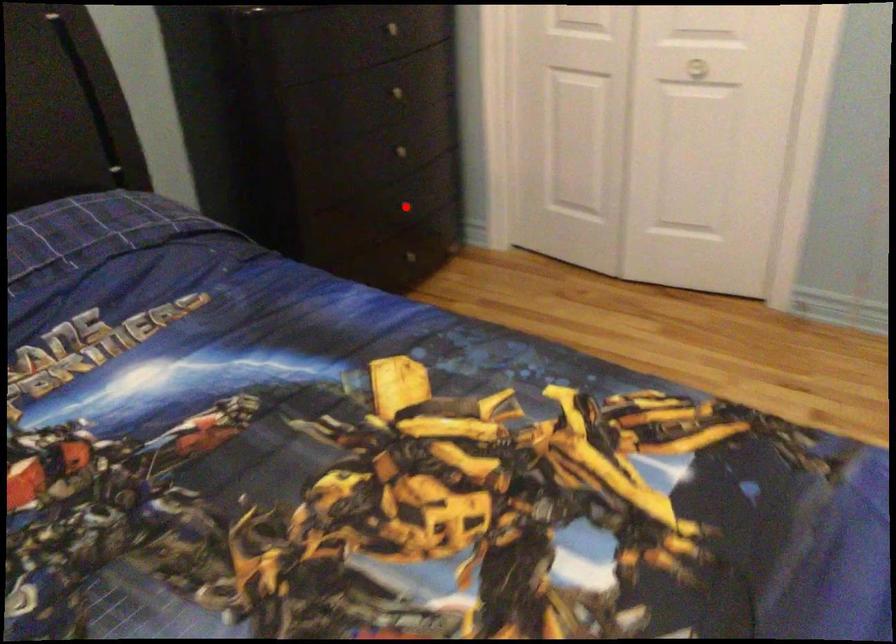
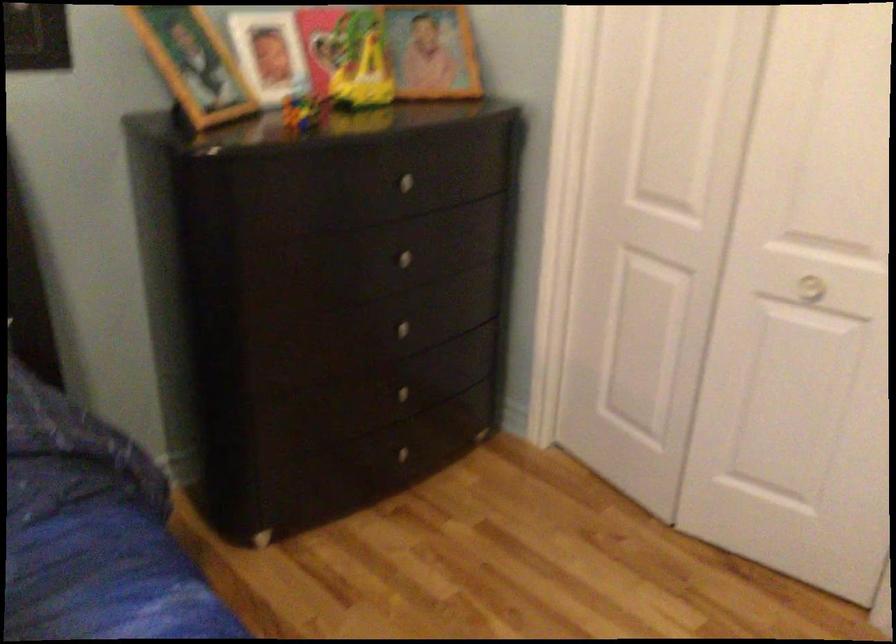
Find the pixel in the second image that matches the highlighted location in the first image.

(400, 393)